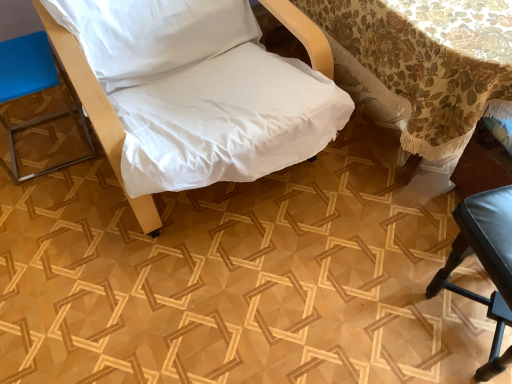
At what (x,y) coordinates should I click in order to perform the action: click on vacant region in front of white fabric chair at center, which is counted as the second furniture, starting from the right. Please return your answer as a coordinate pair (x, y). This screenshot has width=512, height=384. Looking at the image, I should click on (207, 303).